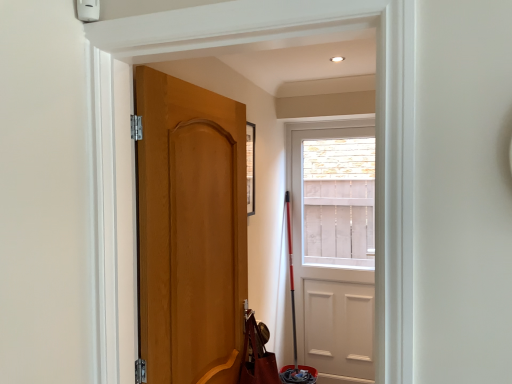
Question: Is brown leather shoulder bag at lower left bigger or smaller than white matte door at center, which is counted as the 2th door, starting from the left?

Choices:
 (A) small
 (B) big

Answer: (A)

Question: From the image's perspective, is brown leather shoulder bag at lower left positioned above or below white matte door at center, placed as the 2th door when sorted from front to back?

Choices:
 (A) below
 (B) above

Answer: (A)

Question: Which object is positioned farthest from the matte wood door at center, positioned as the first door in front-to-back order?

Choices:
 (A) white matte door at center, the 1th door when ordered from right to left
 (B) brown leather shoulder bag at lower left

Answer: (A)

Question: Based on their relative distances, which object is nearer to the white matte door at center, which is counted as the 2th door, starting from the left?

Choices:
 (A) matte wood door at center, which is the second door from right to left
 (B) brown leather shoulder bag at lower left

Answer: (B)